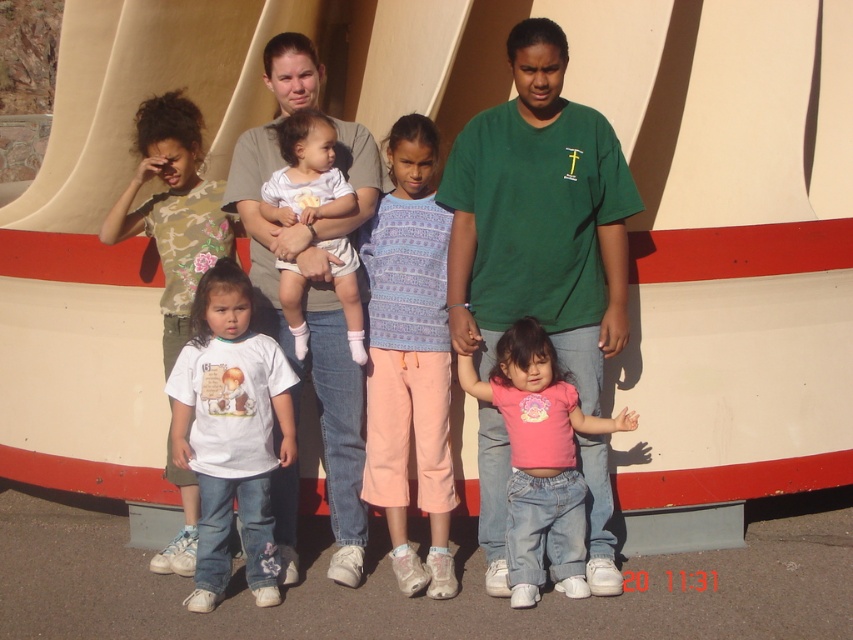
Is green cotton shirt at center positioned at the back of pink cotton shirt at center?

Yes.

Can you confirm if green cotton shirt at center is thinner than pink cotton shirt at center?

No.

I want to click on green cotton shirt at center, so click(538, 218).

Is purple knit sweater at center above matte gray shirt at center?

Actually, purple knit sweater at center is below matte gray shirt at center.

Which is above, purple knit sweater at center or matte gray shirt at center?

Positioned higher is matte gray shirt at center.

The width and height of the screenshot is (853, 640). What do you see at coordinates (409, 356) in the screenshot?
I see `purple knit sweater at center` at bounding box center [409, 356].

I want to click on purple knit sweater at center, so click(409, 356).

Does pink cotton shirt at center appear under white cotton onesie at center?

Indeed, pink cotton shirt at center is positioned under white cotton onesie at center.

Which is behind, point (494, 376) or point (289, 120)?

The point (289, 120) is more distant.

This screenshot has height=640, width=853. What are the coordinates of `pink cotton shirt at center` in the screenshot? It's located at (540, 460).

Locate an element on the screen. The width and height of the screenshot is (853, 640). pink cotton shirt at center is located at coordinates (540, 460).